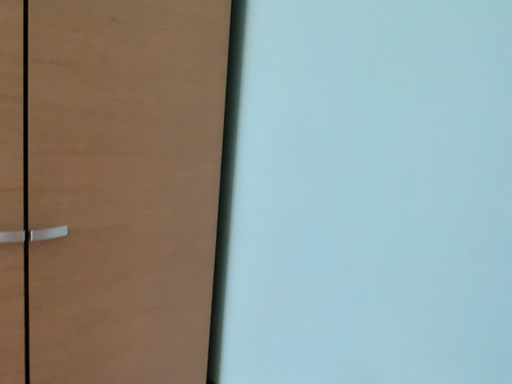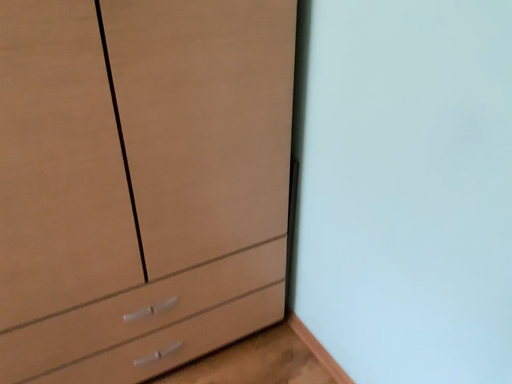
Question: Which way did the camera rotate in the video?

Choices:
 (A) rotated downward
 (B) rotated upward

Answer: (A)